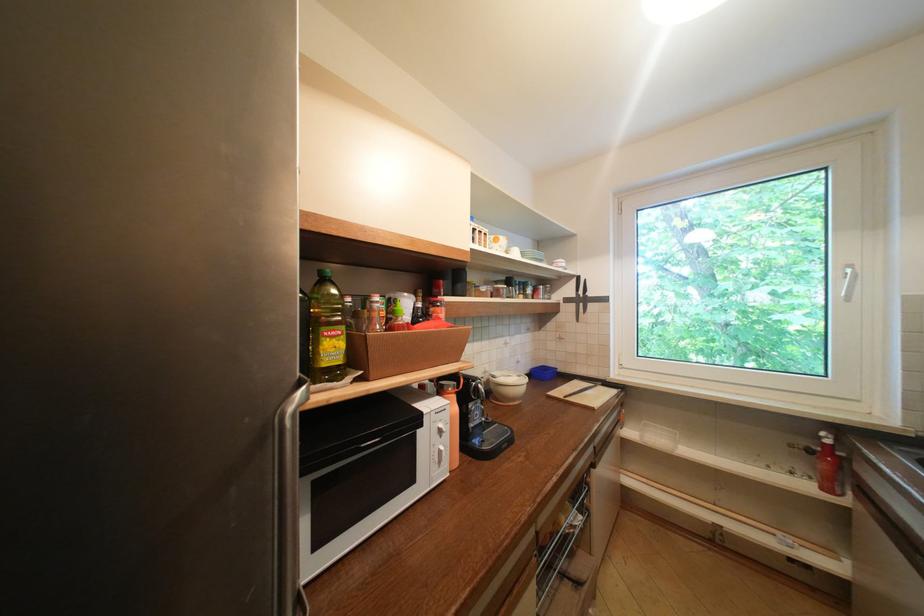
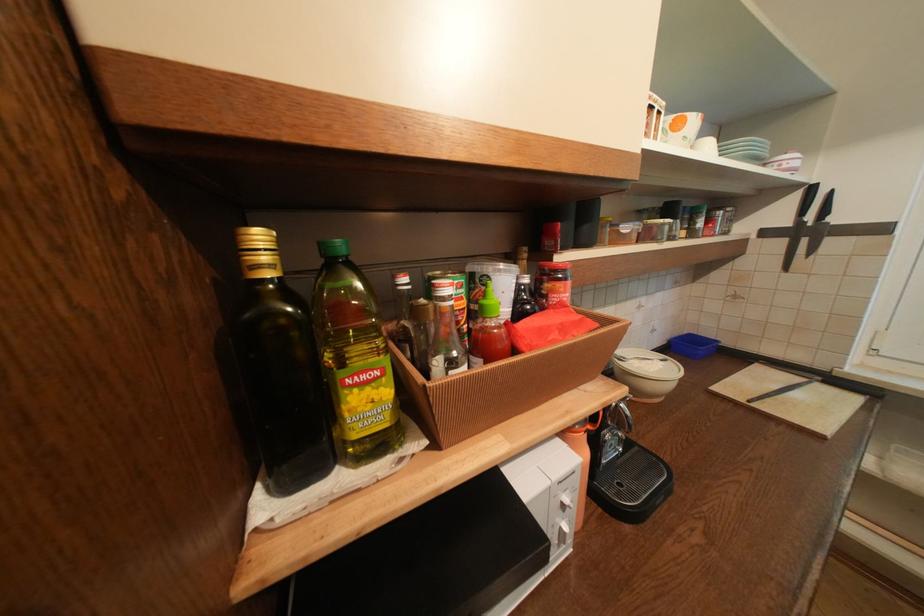
The point at (345, 334) is marked in the first image. Where is the corresponding point in the second image?

(379, 377)